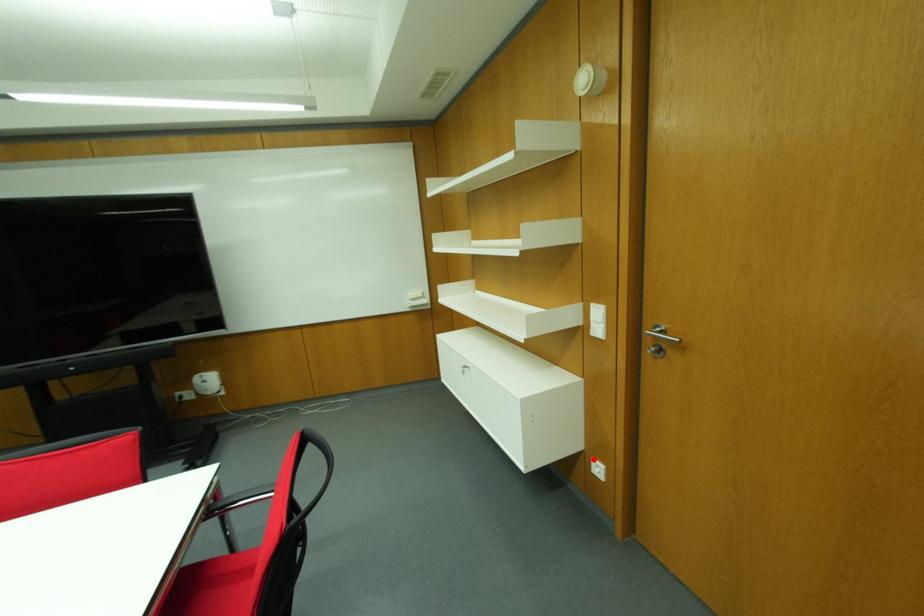
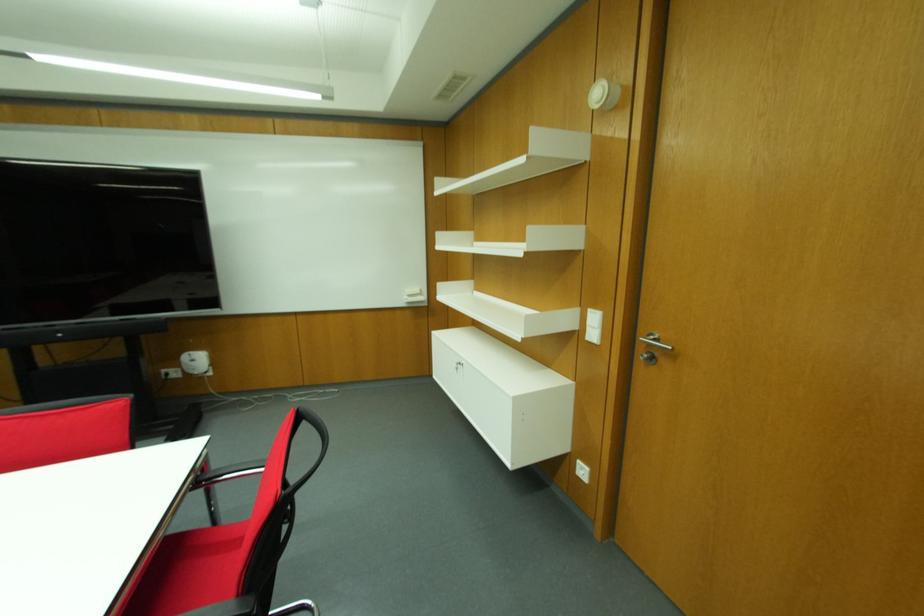
Where in the second image is the point corresponding to the highlighted location from the first image?

(578, 463)